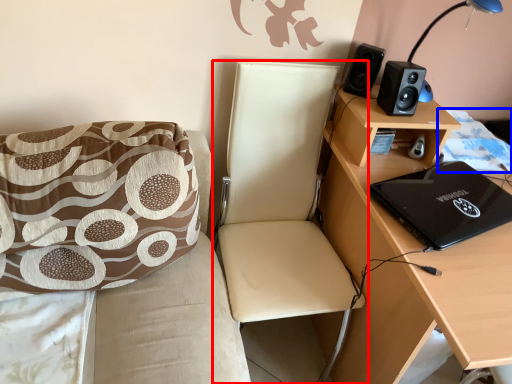
Question: Among these objects, which one is nearest to the camera, chair (highlighted by a red box) or quilt (highlighted by a blue box)?

Choices:
 (A) chair
 (B) quilt

Answer: (A)